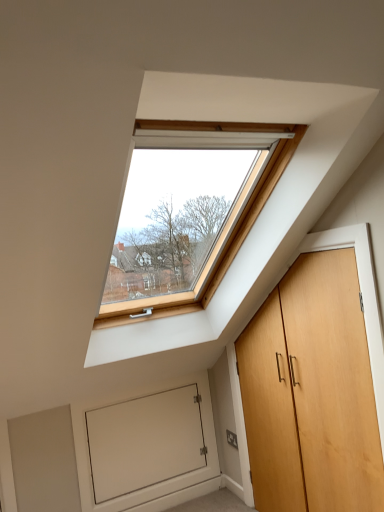
Image resolution: width=384 pixels, height=512 pixels. What do you see at coordinates (311, 393) in the screenshot?
I see `light brown wood door at right` at bounding box center [311, 393].

The height and width of the screenshot is (512, 384). I want to click on light brown wood door at right, so click(x=311, y=393).

What do you see at coordinates (146, 450) in the screenshot? The height and width of the screenshot is (512, 384). I see `white matte door at lower left` at bounding box center [146, 450].

Find the location of a particular element. white matte door at lower left is located at coordinates (146, 450).

The height and width of the screenshot is (512, 384). I want to click on light brown wood door at right, so click(311, 393).

Which object is positioned more to the left, light brown wood door at right or white matte door at lower left?

From the viewer's perspective, white matte door at lower left appears more on the left side.

Based on the photo, is the position of light brown wood door at right less distant than that of white matte door at lower left?

Yes, the depth of light brown wood door at right is less than that of white matte door at lower left.

Does point (356, 312) appear closer or farther from the camera than point (155, 475)?

Clearly, point (356, 312) is closer to the camera than point (155, 475).

From the image's perspective, which is above, light brown wood door at right or white matte door at lower left?

light brown wood door at right.

From a real-world perspective, is light brown wood door at right positioned over white matte door at lower left based on gravity?

Correct, in the physical world, light brown wood door at right is higher than white matte door at lower left.

Can you confirm if light brown wood door at right is thinner than white matte door at lower left?

No, light brown wood door at right is not thinner than white matte door at lower left.

In the scene shown: Who is taller, light brown wood door at right or white matte door at lower left?

With more height is light brown wood door at right.

Does light brown wood door at right have a larger size compared to white matte door at lower left?

Yes.

Is light brown wood door at right positioned beyond the bounds of white matte door at lower left?

Yes, light brown wood door at right is located beyond the bounds of white matte door at lower left.

Are light brown wood door at right and white matte door at lower left located far from each other?

light brown wood door at right is actually quite close to white matte door at lower left.

Is light brown wood door at right turned away from white matte door at lower left?

No.

Measure the distance between light brown wood door at right and white matte door at lower left.

They are 36.19 inches apart.

Where is `door in front of the white matte door at lower left`? This screenshot has height=512, width=384. door in front of the white matte door at lower left is located at coordinates (311, 393).

Can you confirm if white matte door at lower left is positioned to the right of light brown wood door at right?

Incorrect, white matte door at lower left is not on the right side of light brown wood door at right.

Is white matte door at lower left behind light brown wood door at right?

Yes, white matte door at lower left is further from the camera.

Between point (104, 429) and point (262, 351), which one is positioned in front?

The point (262, 351) is in front.

From the image's perspective, which is above, white matte door at lower left or light brown wood door at right?

From the image's view, light brown wood door at right is above.

From a real-world perspective, is white matte door at lower left above or below light brown wood door at right?

white matte door at lower left is below light brown wood door at right.

Considering the sizes of objects white matte door at lower left and light brown wood door at right in the image provided, who is wider, white matte door at lower left or light brown wood door at right?

With larger width is light brown wood door at right.

Can you confirm if white matte door at lower left is taller than light brown wood door at right?

No, white matte door at lower left is not taller than light brown wood door at right.

Does white matte door at lower left have a larger size compared to light brown wood door at right?

No, white matte door at lower left is not bigger than light brown wood door at right.

Is white matte door at lower left not inside light brown wood door at right?

Yes, white matte door at lower left is located beyond the bounds of light brown wood door at right.

Is there a large distance between white matte door at lower left and light brown wood door at right?

No, white matte door at lower left is not far away from light brown wood door at right.

Is white matte door at lower left oriented away from light brown wood door at right?

No, white matte door at lower left is not facing away from light brown wood door at right.

How different are the orientations of white matte door at lower left and light brown wood door at right in degrees?

white matte door at lower left and light brown wood door at right are facing 90 degrees away from each other.

How much distance is there between white matte door at lower left and light brown wood door at right?

A distance of 91.92 centimeters exists between white matte door at lower left and light brown wood door at right.

Where is `garage door behind the light brown wood door at right`? garage door behind the light brown wood door at right is located at coordinates (146, 450).

In order to click on garage door below the light brown wood door at right (from the image's perspective) in this screenshot , I will do (146, 450).

Image resolution: width=384 pixels, height=512 pixels. I want to click on garage door on the left of light brown wood door at right, so click(146, 450).